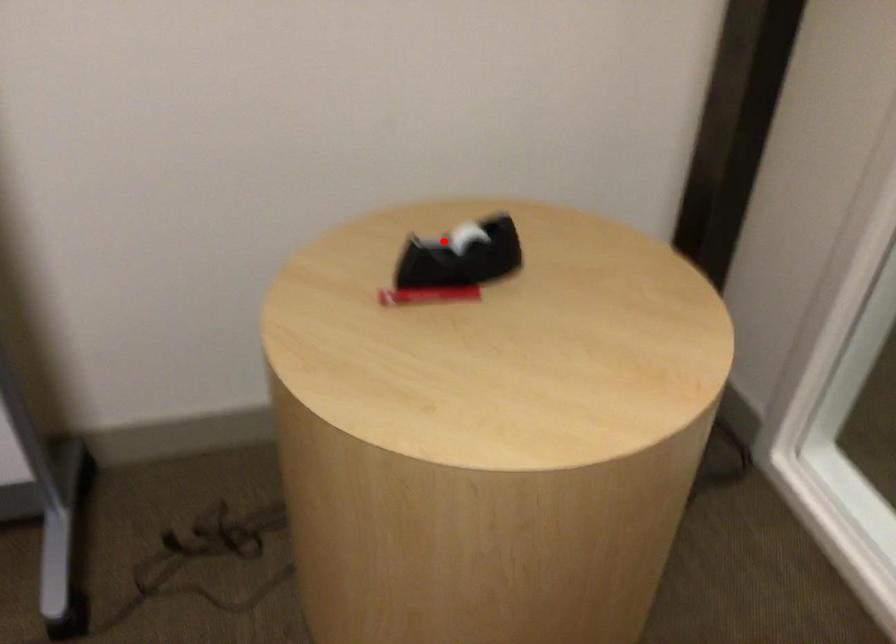
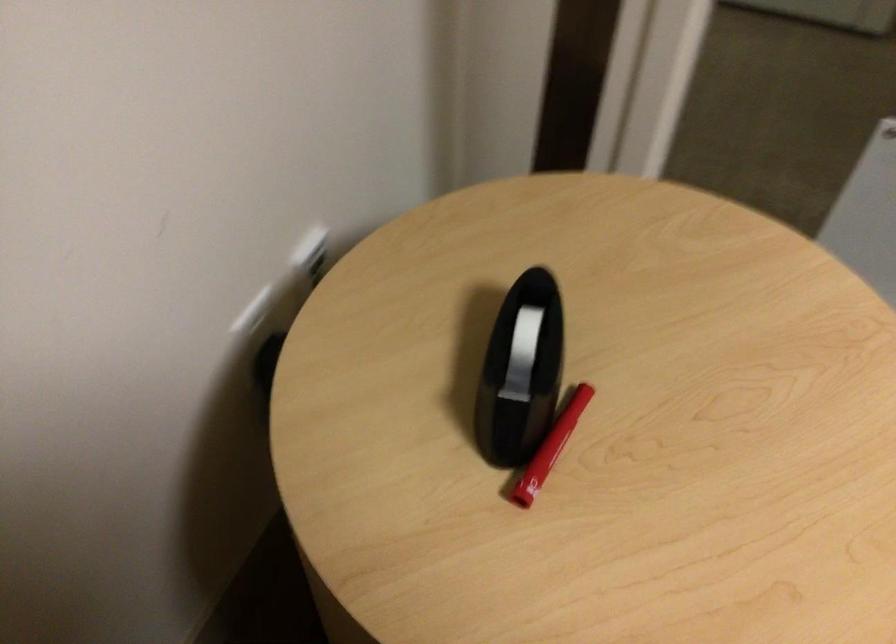
Find the pixel in the second image that matches the highlighted location in the first image.

(521, 354)